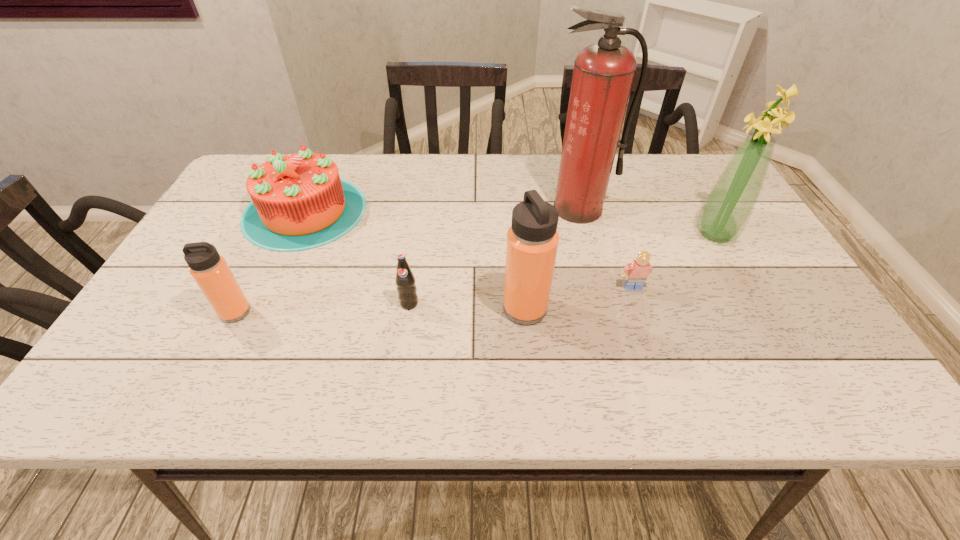
In order to click on the second shortest object in this screenshot , I will do `click(407, 291)`.

Locate an element on the screen. free space located on the back of the shorter thermos bottle is located at coordinates 280,222.

The height and width of the screenshot is (540, 960). In order to click on vacant space located on the right of the taller thermos bottle in this screenshot , I will do `click(683, 309)`.

Identify the location of vacant space situated 0.050m on the front-facing side of the bouquet. (676, 234).

Locate an element on the screen. This screenshot has height=540, width=960. vacant space located 0.180m on the front-facing side of the bouquet is located at coordinates (626, 234).

I want to click on vacant space located 0.130m on the front-facing side of the bouquet, so click(x=645, y=234).

Image resolution: width=960 pixels, height=540 pixels. What are the coordinates of `free region located on the back of the cake` in the screenshot? It's located at [x=327, y=161].

Locate an element on the screen. The height and width of the screenshot is (540, 960). free space located on the front-facing side of the fourth nearest object is located at coordinates (640, 313).

At what (x,y) coordinates should I click in order to perform the action: click on free spot located at the nozzle of the fire extinguisher. Please return your answer as a coordinate pair (x, y). Image resolution: width=960 pixels, height=540 pixels. Looking at the image, I should click on (591, 257).

Image resolution: width=960 pixels, height=540 pixels. I want to click on vacant region located 0.050m on the front label of the second shortest object, so click(405, 328).